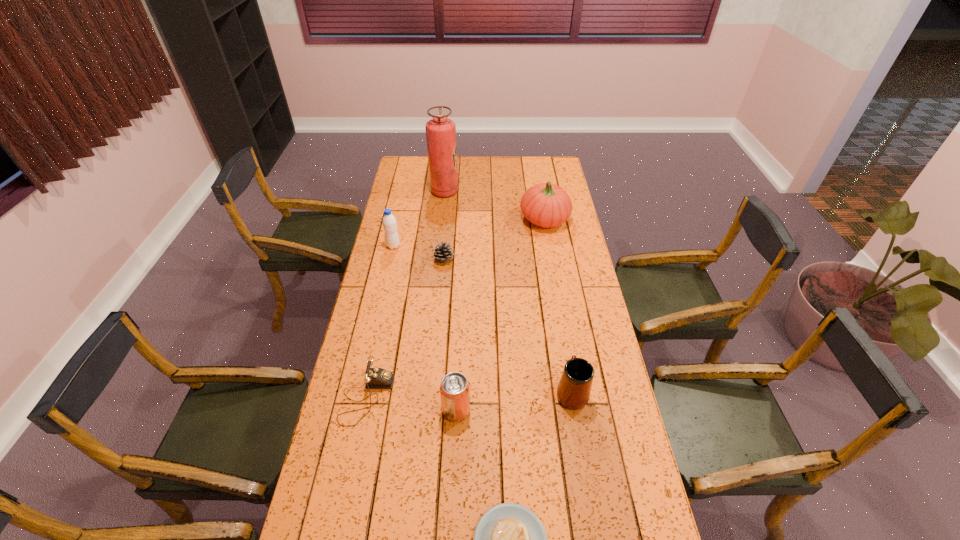
Image resolution: width=960 pixels, height=540 pixels. I want to click on vacant region located 0.180m on the front of the sixth nearest object, so click(x=386, y=279).

Locate an element on the screen. Image resolution: width=960 pixels, height=540 pixels. free space located on the side of the mug with the handle is located at coordinates (554, 288).

This screenshot has height=540, width=960. What are the coordinates of `vacant space located on the side of the mug with the handle` in the screenshot? It's located at [x=557, y=305].

At what (x,y) coordinates should I click in order to perform the action: click on vacant space located 0.150m on the side of the mug with the handle. Please return your answer as a coordinate pair (x, y). Looking at the image, I should click on (563, 338).

At what (x,y) coordinates should I click in order to perform the action: click on free space located 0.240m on the right of the soda can. Please return your answer as a coordinate pair (x, y). The height and width of the screenshot is (540, 960). Looking at the image, I should click on (548, 410).

This screenshot has height=540, width=960. I want to click on blank space located on the dial of the telephone, so click(x=410, y=397).

Identify the location of free space located on the back of the pinecone. (448, 210).

Where is `water bottle situated at the left edge`? The height and width of the screenshot is (540, 960). water bottle situated at the left edge is located at coordinates (389, 222).

Where is `telephone located at the left edge`? telephone located at the left edge is located at coordinates (375, 378).

At what (x,y) coordinates should I click in order to perform the action: click on pumpkin present at the right edge. Please return your answer as a coordinate pair (x, y). The image size is (960, 540). Looking at the image, I should click on (547, 205).